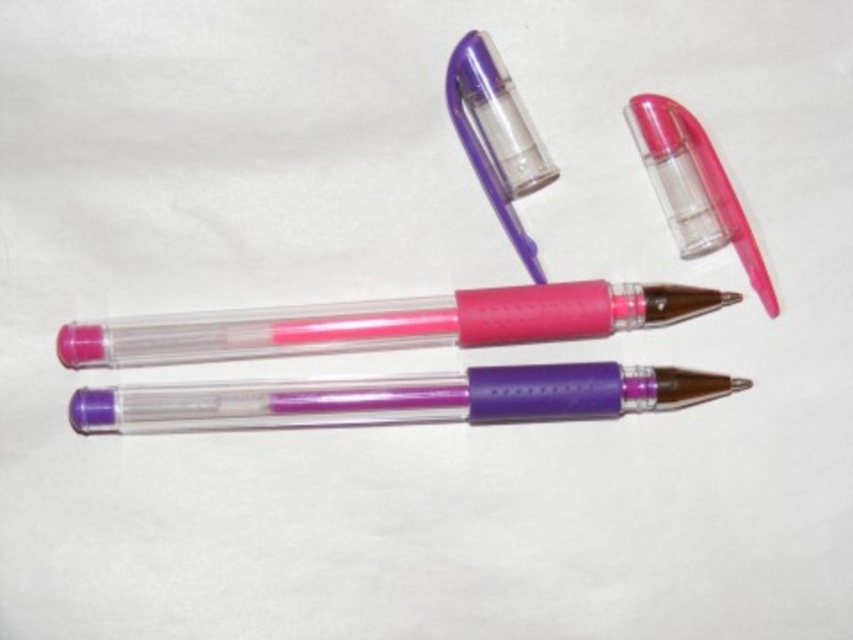
Question: Can you confirm if pink translucent pen at center is positioned below pink translucent lipstick at upper right?

Choices:
 (A) no
 (B) yes

Answer: (B)

Question: Considering the relative positions of purple translucent pen at center and pink translucent lipstick at upper right in the image provided, where is purple translucent pen at center located with respect to pink translucent lipstick at upper right?

Choices:
 (A) below
 (B) above

Answer: (A)

Question: Which of the following is the farthest from the observer?

Choices:
 (A) (670, 216)
 (B) (552, 300)

Answer: (B)

Question: Is pink translucent pen at center closer to camera compared to purple translucent pen at center?

Choices:
 (A) yes
 (B) no

Answer: (B)

Question: Which point is closer to the camera?

Choices:
 (A) pink translucent lipstick at upper right
 (B) pink translucent pen at center
 (C) purple translucent pen at center

Answer: (C)

Question: Which object is the closest to the pink translucent lipstick at upper right?

Choices:
 (A) pink translucent pen at center
 (B) purple translucent pen at center

Answer: (A)